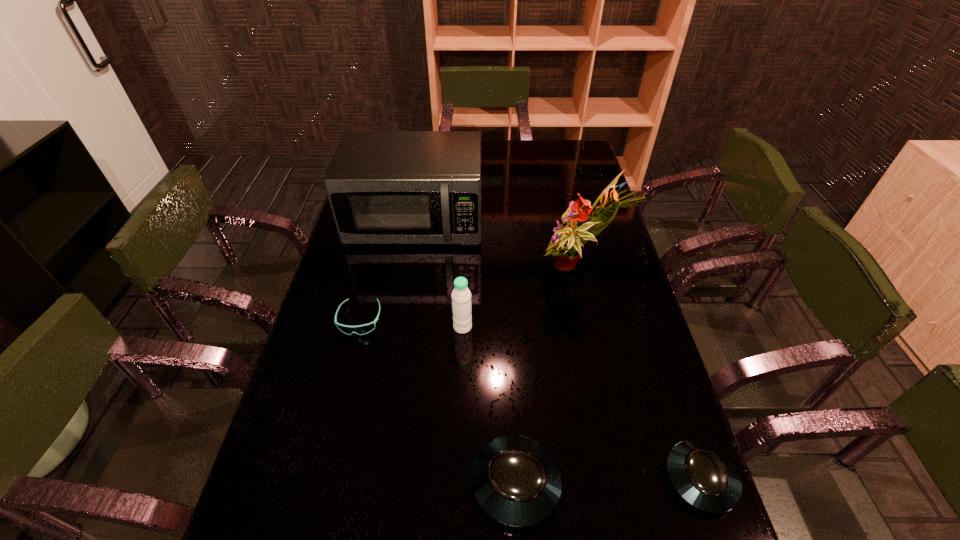
You are a GUI agent. You are given a task and a screenshot of the screen. Output one action in this format:
    pyautogui.click(x=<x>, y=<y>)
    Task: Click on the vacant area that lies between the second shortest object and the fifth shortest object
    The height and width of the screenshot is (540, 960).
    Given the screenshot: What is the action you would take?
    pyautogui.click(x=558, y=350)

Image resolution: width=960 pixels, height=540 pixels. I want to click on vacant point located between the left saucer and the second tallest object, so click(x=466, y=353).

At what (x,y) coordinates should I click in order to perform the action: click on free space between the taller saucer and the fourth shortest object. Please return your answer as a coordinate pair (x, y). The height and width of the screenshot is (540, 960). Looking at the image, I should click on [x=489, y=405].

Where is `vacant area that lies between the shorter saucer and the sunglasses`? vacant area that lies between the shorter saucer and the sunglasses is located at coordinates (530, 399).

In order to click on object that is the third closest one to the third shortest object in this screenshot , I will do `click(366, 328)`.

Find the location of a particular element. This screenshot has width=960, height=540. object identified as the fifth closest to the right saucer is located at coordinates (384, 187).

Where is `free point that satisfies the following two spatial constraints: 1. on the front-facing side of the second tallest object; 2. on the left side of the fourth tallest object`? free point that satisfies the following two spatial constraints: 1. on the front-facing side of the second tallest object; 2. on the left side of the fourth tallest object is located at coordinates (372, 483).

You are a GUI agent. You are given a task and a screenshot of the screen. Output one action in this format:
    pyautogui.click(x=<x>, y=<y>)
    Task: Click on the free location that satisfies the following two spatial constraints: 1. on the front-facing side of the fifth shortest object; 2. on the left side of the third shortest object
    The image size is (960, 540).
    Given the screenshot: What is the action you would take?
    pyautogui.click(x=372, y=483)

Image resolution: width=960 pixels, height=540 pixels. Identify the location of vacant region that satisfies the following two spatial constraints: 1. on the front-facing side of the fourth shortest object; 2. on the right side of the sunglasses. (358, 327).

This screenshot has height=540, width=960. I want to click on vacant space that satisfies the following two spatial constraints: 1. on the front-facing side of the second shortest object; 2. on the right side of the bouquet, so click(x=624, y=478).